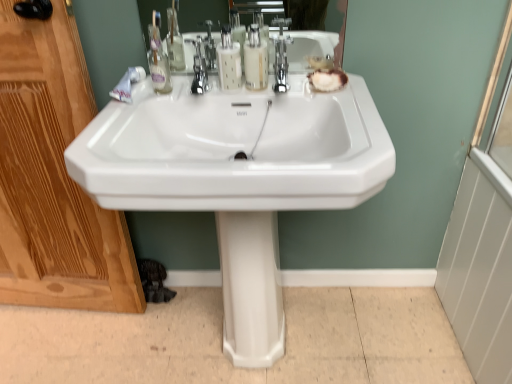
Identify the location of vacant space situated on the left part of white glossy pedestal at center. The height and width of the screenshot is (384, 512). (194, 337).